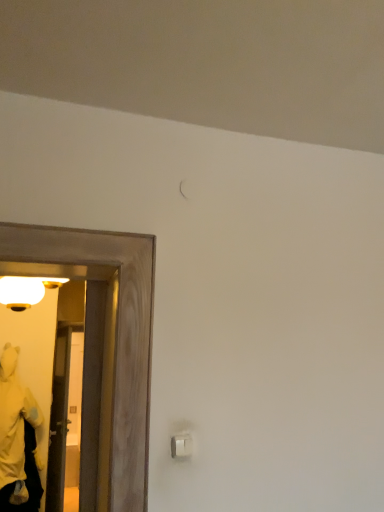
Question: In terms of height, does wooden door at left look taller or shorter compared to white plastic light switch at lower right?

Choices:
 (A) tall
 (B) short

Answer: (A)

Question: Would you say wooden door at left is inside or outside white plastic light switch at lower right?

Choices:
 (A) outside
 (B) inside

Answer: (A)

Question: Considering the real-world distances, which object is closest to the transparent glass door at left?

Choices:
 (A) white plastic light switch at lower right
 (B) matte white globe at left
 (C) wooden door at left
 (D) yellow plush at left

Answer: (C)

Question: Which object is the closest to the transparent glass door at left?

Choices:
 (A) white plastic light switch at lower right
 (B) wooden door at left
 (C) yellow plush at left
 (D) matte white globe at left

Answer: (B)